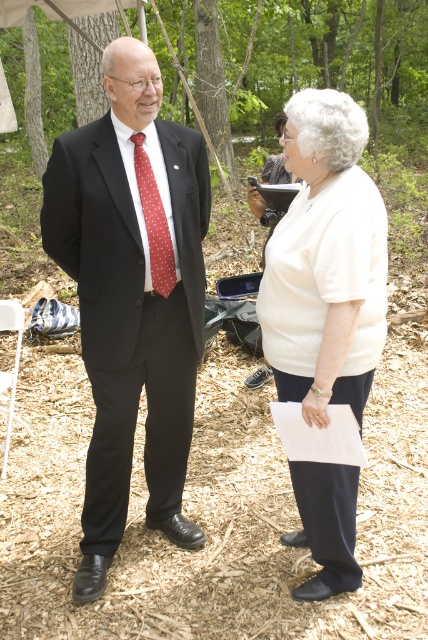
You are a photographer setting up for a portrait in this scene. You need to position a spotlight to the right of both the matte black suit at center and the white cotton shirt at center. Is this possible given their current positions?

The matte black suit at center is to the left of the white cotton shirt at center. Since the spotlight needs to be placed to the right of both, it is possible as long as the spotlight is positioned further to the right of the white cotton shirt at center.

You are a photographer setting up for a group photo. You need to position the matte black suit at center and the white cotton shirt at center so that both are fully visible. Based on their sizes, which one should be placed closer to the camera to ensure neither blocks the other?

The matte black suit at center might be wider than the white cotton shirt at center, so to ensure both are fully visible, the wider matte black suit at center should be placed closer to the camera. This way, the narrower white cotton shirt at center can be positioned behind without being obscured.